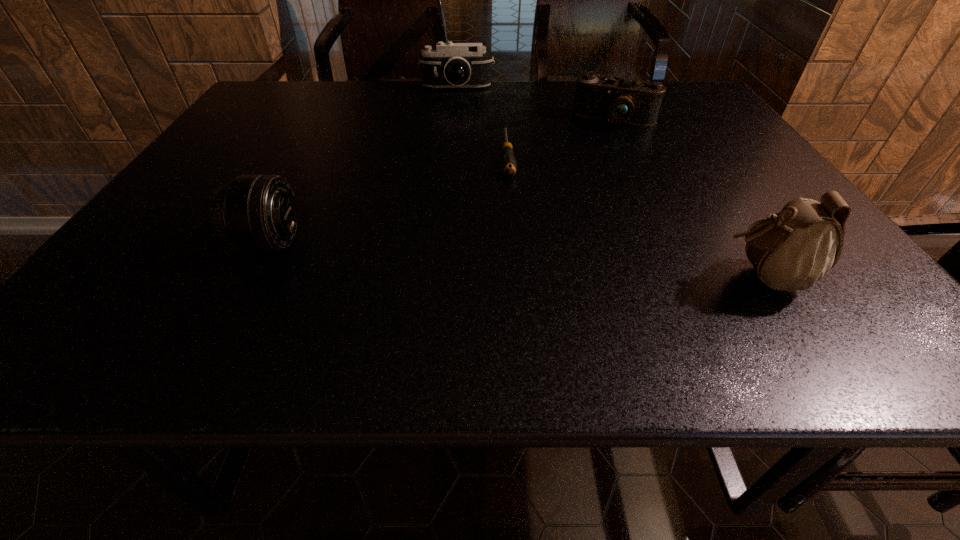
Where is `the leftmost object`? The width and height of the screenshot is (960, 540). the leftmost object is located at coordinates (255, 212).

Find the location of a particular element. The width and height of the screenshot is (960, 540). pouch is located at coordinates (791, 250).

The image size is (960, 540). Find the location of `the second shortest object`. the second shortest object is located at coordinates (625, 101).

The image size is (960, 540). Identify the location of the right camera. (625, 101).

Identify the location of the third object from right to left. This screenshot has width=960, height=540. (508, 163).

Identify the location of screwdriver. The height and width of the screenshot is (540, 960). (508, 163).

Image resolution: width=960 pixels, height=540 pixels. Identify the location of the farthest object. (451, 65).

Identify the location of the second object from left to right. The height and width of the screenshot is (540, 960). (451, 65).

The width and height of the screenshot is (960, 540). I want to click on free region located on the front-facing side of the leftmost object, so click(x=427, y=242).

Locate an element on the screen. The image size is (960, 540). free location located on the front-facing side of the pouch is located at coordinates [x=673, y=278].